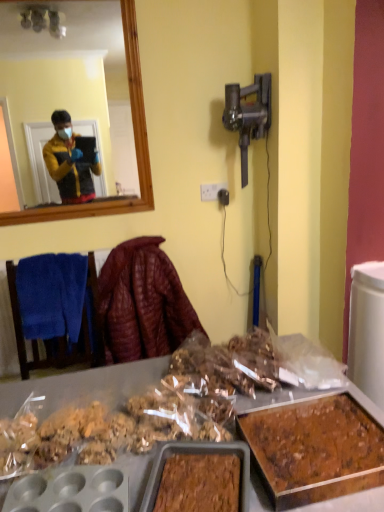
Question: From the image's perspective, is brown crumbly cake at lower right on top of leather-like maroon jacket at center?

Choices:
 (A) yes
 (B) no

Answer: (B)

Question: Considering the relative sizes of brown crumbly cake at lower right and leather-like maroon jacket at center in the image provided, is brown crumbly cake at lower right taller than leather-like maroon jacket at center?

Choices:
 (A) no
 (B) yes

Answer: (A)

Question: Is brown crumbly cake at lower right positioned beyond the bounds of leather-like maroon jacket at center?

Choices:
 (A) yes
 (B) no

Answer: (A)

Question: Does brown crumbly cake at lower right have a lesser height compared to leather-like maroon jacket at center?

Choices:
 (A) yes
 (B) no

Answer: (A)

Question: Considering the relative sizes of brown crumbly cake at lower right and leather-like maroon jacket at center in the image provided, is brown crumbly cake at lower right smaller than leather-like maroon jacket at center?

Choices:
 (A) yes
 (B) no

Answer: (A)

Question: From the image's perspective, would you say brown crumbly cake at lower right is shown under leather-like maroon jacket at center?

Choices:
 (A) yes
 (B) no

Answer: (A)

Question: Is leather-like maroon jacket at center thinner than brown crumbly cake at lower right?

Choices:
 (A) no
 (B) yes

Answer: (B)

Question: From a real-world perspective, is leather-like maroon jacket at center positioned under brown crumbly cake at lower right based on gravity?

Choices:
 (A) no
 (B) yes

Answer: (B)

Question: Does leather-like maroon jacket at center have a larger size compared to brown crumbly cake at lower right?

Choices:
 (A) no
 (B) yes

Answer: (B)

Question: From the image's perspective, is leather-like maroon jacket at center below brown crumbly cake at lower right?

Choices:
 (A) yes
 (B) no

Answer: (B)

Question: Does leather-like maroon jacket at center appear on the right side of brown crumbly cake at lower right?

Choices:
 (A) no
 (B) yes

Answer: (A)

Question: Is leather-like maroon jacket at center located outside brown crumbly cake at lower right?

Choices:
 (A) no
 (B) yes

Answer: (B)

Question: Does brown crumbly cake at lower right appear on the right side of white plastic power outlet at center?

Choices:
 (A) yes
 (B) no

Answer: (A)